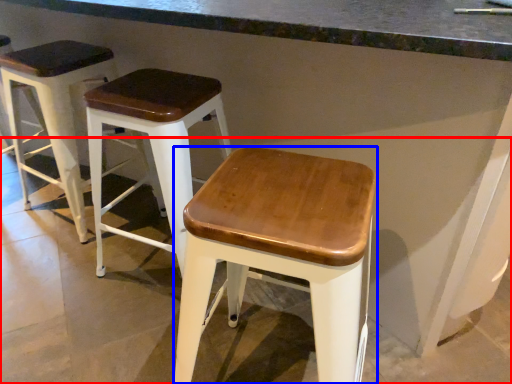
Question: Which object appears closest to the camera in this image, concrete (highlighted by a red box) or stool (highlighted by a blue box)?

Choices:
 (A) concrete
 (B) stool

Answer: (A)